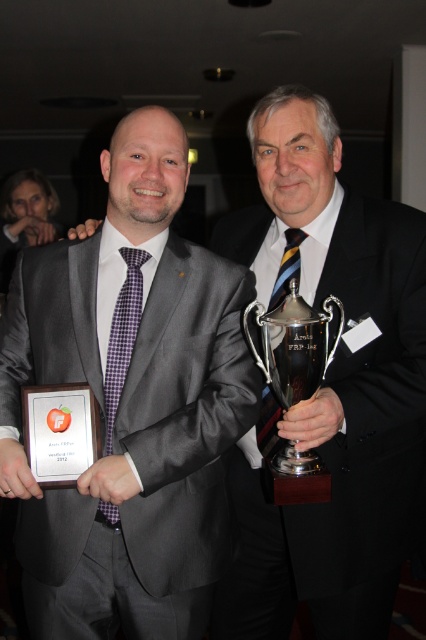
Question: Estimate the real-world distances between objects in this image. Which object is closer to the gray wool suit at center?

Choices:
 (A) black satin business suit at center
 (B) matte gray suit at center

Answer: (B)

Question: Is black satin business suit at center closer to the viewer compared to gray wool suit at center?

Choices:
 (A) yes
 (B) no

Answer: (B)

Question: Which object is the farthest from the matte gray suit at center?

Choices:
 (A) black satin business suit at center
 (B) gray wool suit at center
 (C) silver metallic trophy at center

Answer: (B)

Question: Based on their relative distances, which object is nearer to the matte gray suit at center?

Choices:
 (A) black satin business suit at center
 (B) gray wool suit at center
 (C) silver metallic trophy at center

Answer: (A)

Question: Can you confirm if matte gray suit at center is positioned to the right of gray wool suit at center?

Choices:
 (A) no
 (B) yes

Answer: (B)

Question: Can you confirm if black satin business suit at center is bigger than silver metallic trophy at center?

Choices:
 (A) yes
 (B) no

Answer: (A)